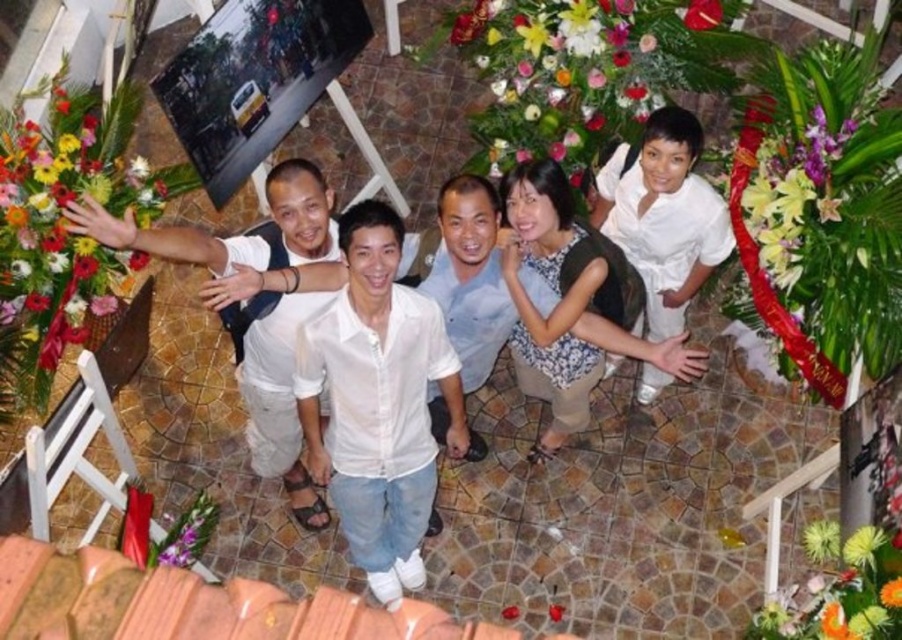
Question: Which point appears closest to the camera in this image?

Choices:
 (A) (67, 186)
 (B) (793, 220)

Answer: (B)

Question: Which point appears closest to the camera in this image?

Choices:
 (A) (45, 259)
 (B) (741, 173)

Answer: (A)

Question: Can you confirm if dark green fabric dress at center is bigger than white satin dress at upper right?

Choices:
 (A) no
 (B) yes

Answer: (B)

Question: Is floral arrangement at upper center to the left of floral bouquet at left from the viewer's perspective?

Choices:
 (A) yes
 (B) no

Answer: (B)

Question: Which point is closer to the camera?

Choices:
 (A) dark green fabric dress at center
 (B) floral arrangement at upper center

Answer: (A)

Question: Can you confirm if white satin dress at upper right is bigger than purple silk flower at upper right?

Choices:
 (A) no
 (B) yes

Answer: (B)